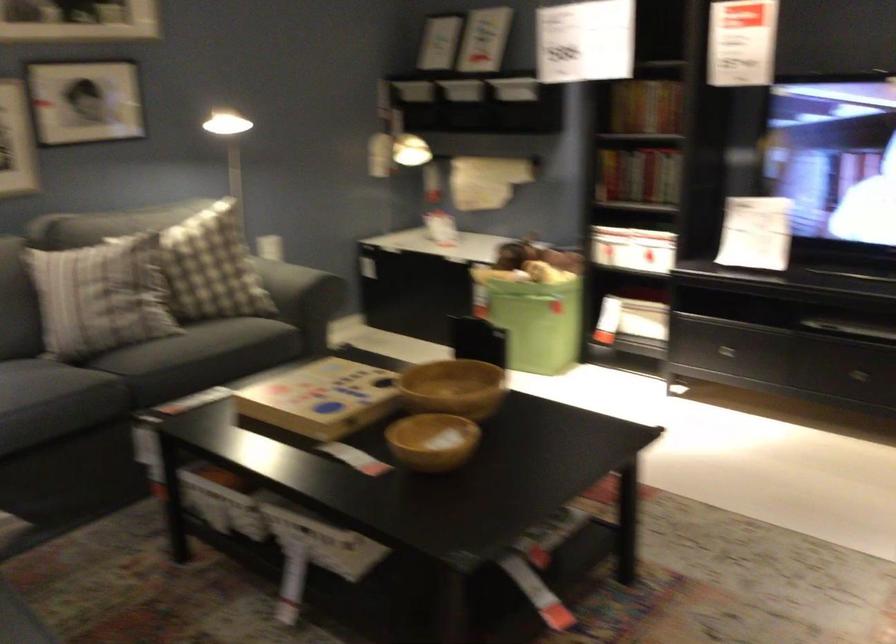
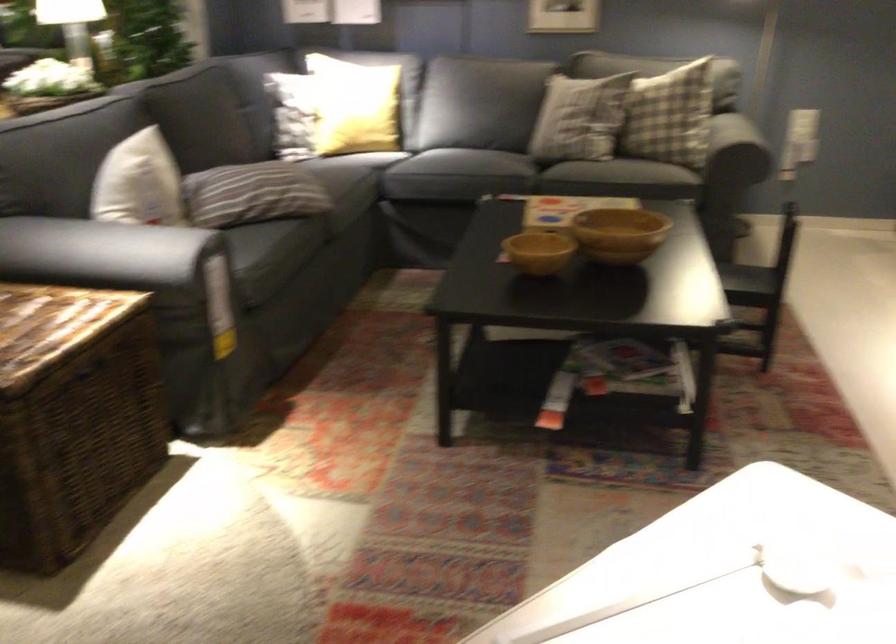
The point at (436, 395) is marked in the first image. Where is the corresponding point in the second image?

(618, 234)